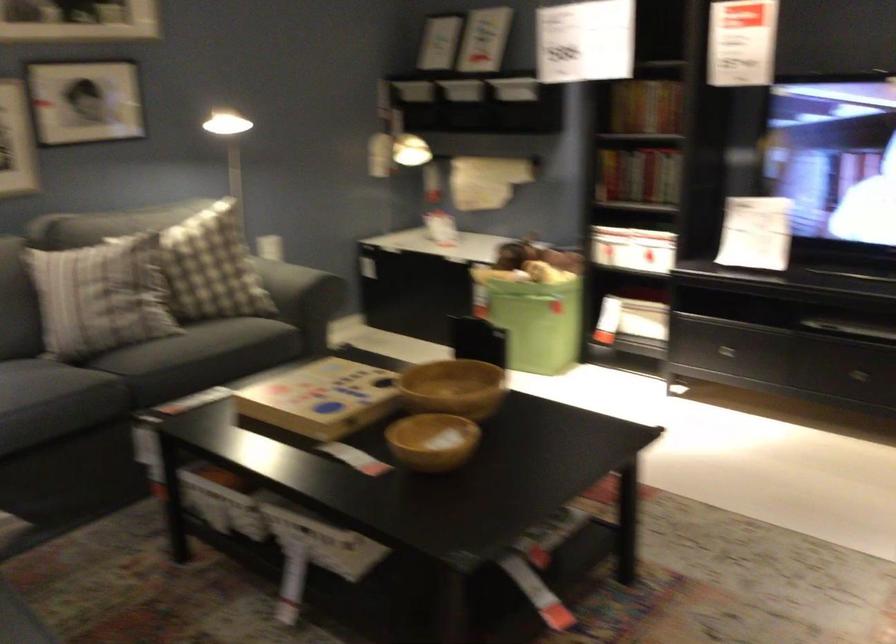
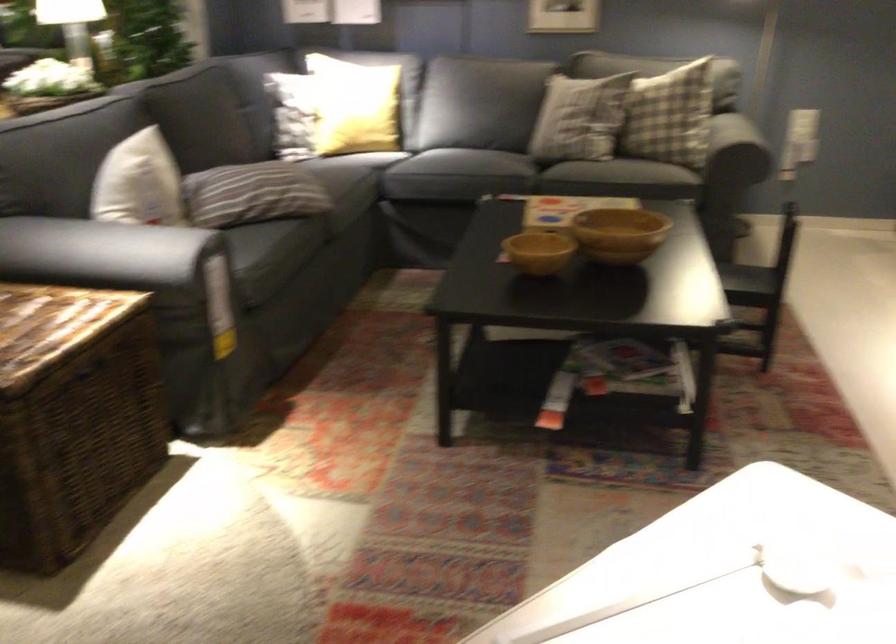
The point at (436, 395) is marked in the first image. Where is the corresponding point in the second image?

(618, 234)